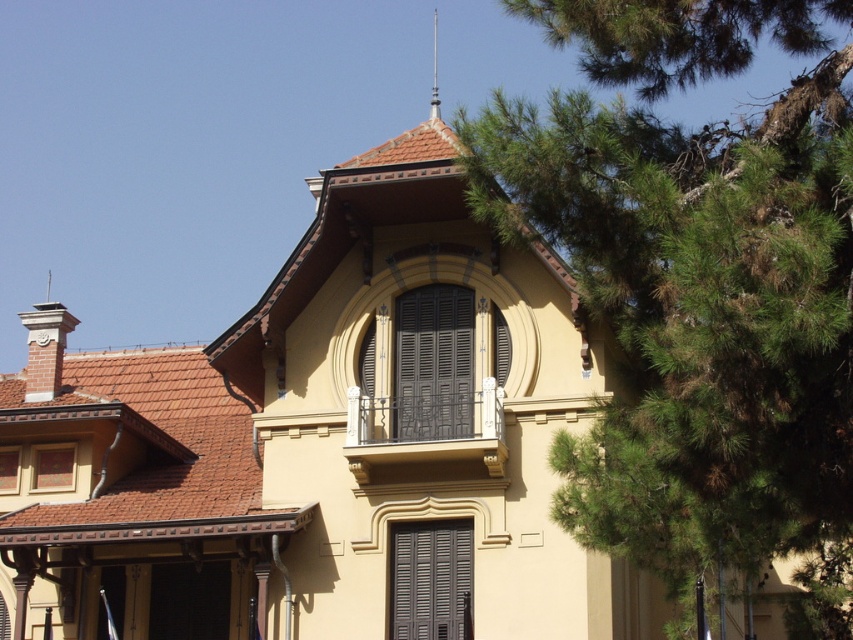
Looking at the building with its arched window and balcony, where is the green leafy tree at upper right in relation to the dark gray matte shutters at center?

The green leafy tree at upper right is to the right of the dark gray matte shutters at center.

Looking at this image, you are an architect analyzing the building facade. You need to determine the spatial relationship between the dark gray matte shutters at center and the polished silver spire at upper center. Which object is positioned higher on the building?

The polished silver spire at upper center is positioned higher on the building than the dark gray matte shutters at center.

What are the coordinates of the dark gray matte shutters at center?

The dark gray matte shutters at center are located at coordinates point (430, 579).